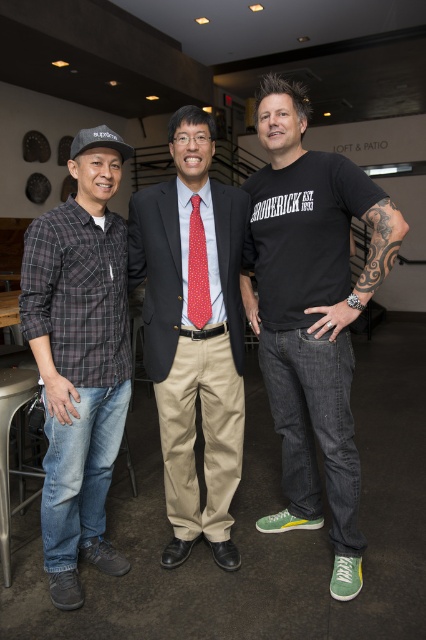
Who is positioned more to the right, red dotted tie at center or brushed metal bar stool at lower left?

From the viewer's perspective, red dotted tie at center appears more on the right side.

Can you confirm if red dotted tie at center is positioned to the right of brushed metal bar stool at lower left?

Indeed, red dotted tie at center is positioned on the right side of brushed metal bar stool at lower left.

Which is in front, point (172, 188) or point (16, 410)?

Point (172, 188) is more forward.

Image resolution: width=426 pixels, height=640 pixels. In order to click on red dotted tie at center in this screenshot , I will do `click(193, 332)`.

The width and height of the screenshot is (426, 640). What are the coordinates of `red dotted tie at center` in the screenshot? It's located at (193, 332).

Who is higher up, red dotted tie at center or plaid cotton shirt at left?

red dotted tie at center is above.

Is point (170, 209) less distant than point (71, 332)?

That is False.

Where is `red dotted tie at center`? red dotted tie at center is located at coordinates pos(193,332).

Which is more to the right, black matte t-shirt at right or red dotted fabric tie at center?

Positioned to the right is black matte t-shirt at right.

Measure the distance between black matte t-shirt at right and camera.

black matte t-shirt at right is 1.64 meters away from camera.

Does point (385, 218) lie in front of point (193, 308)?

Yes, point (385, 218) is closer to viewer.

Identify the location of black matte t-shirt at right. (311, 314).